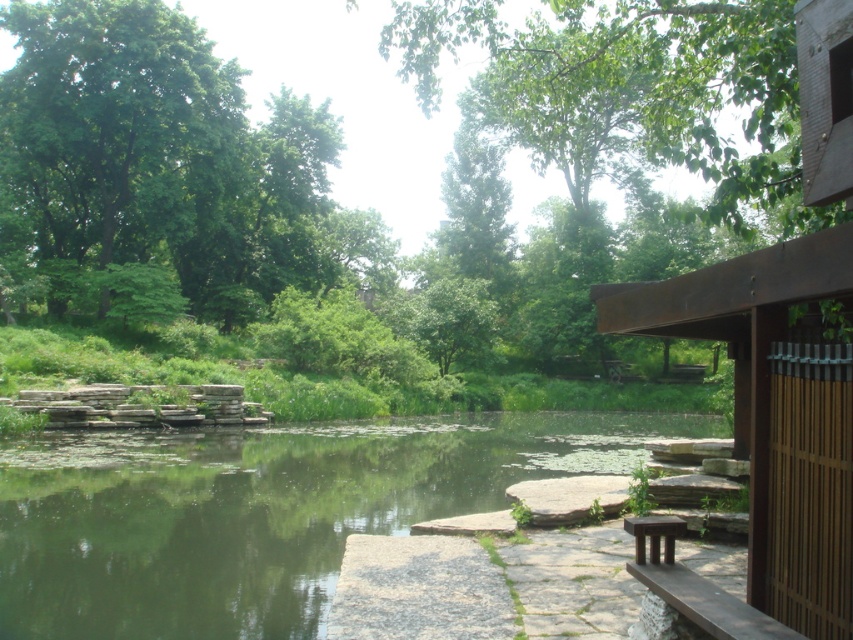
You are a gardener planning to install a new sprinkler system that has a maximum range of 25 meters. You need to water both the green stone river at center and the green leafy tree at upper left. Can you cover both areas with one sprinkler?

The green stone river at center and green leafy tree at upper left are 25.41 meters apart. Since the sprinkler has a maximum range of 25 meters, it cannot cover both areas simultaneously as the distance exceeds the sprinkler range.

You are standing at the entrance of the stone pathway on the left side of the image. You want to walk towards the wooden structure on the right. Which object will you see first as you walk along the path? Please choose between the green stone river at center and the green leafy tree at upper left.

The green stone river at center is in front of the green leafy tree at upper left, so you will see the green stone river at center first as you walk along the path.

You are standing at the wooden structure on the right side of the image. You see a point marked at coordinates [259,512] which is the green stone river at center. If you want to walk to the green stone river at center from your current position, which direction should you head towards?

The point marked at coordinates [259,512] indicates the green stone river at center. Since you are at the wooden structure on the right side of the image, you should head towards the left to reach the green stone river at center.